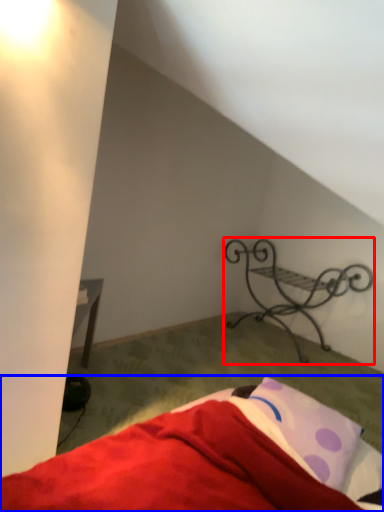
Question: Which object appears closest to the camera in this image, furniture (highlighted by a red box) or bed (highlighted by a blue box)?

Choices:
 (A) furniture
 (B) bed

Answer: (B)